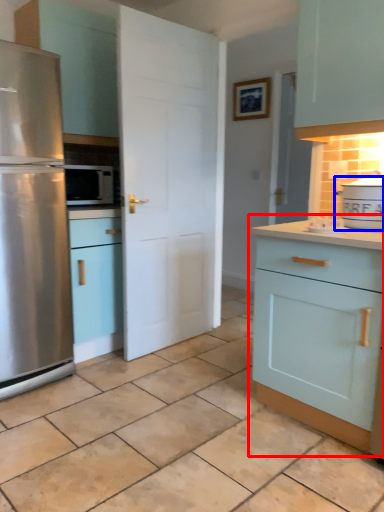
Question: Which point is closer to the camera, cabinetry (highlighted by a red box) or appliance (highlighted by a blue box)?

Choices:
 (A) cabinetry
 (B) appliance

Answer: (A)